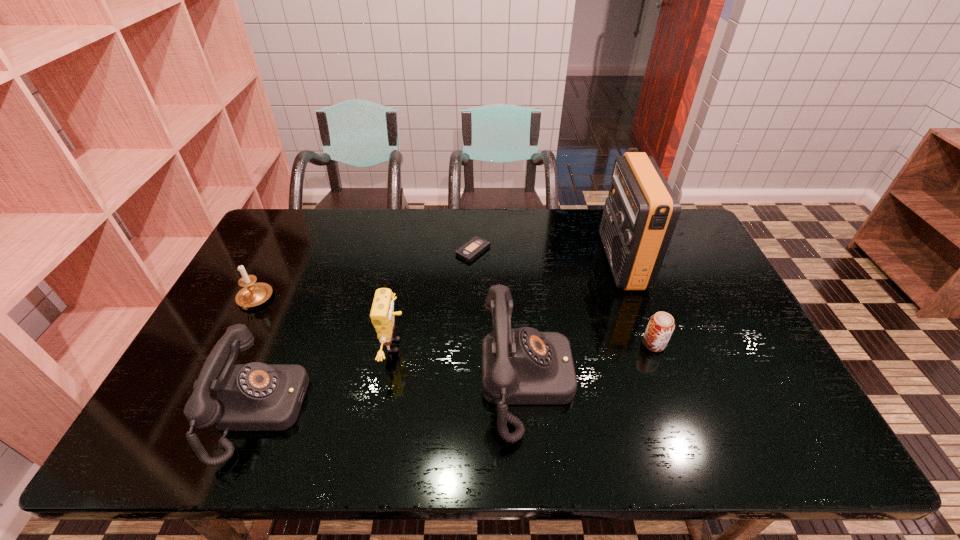
Where is `the left telephone`? This screenshot has width=960, height=540. the left telephone is located at coordinates (255, 396).

At what (x,y) coordinates should I click in order to perform the action: click on the shorter telephone. Please return your answer as a coordinate pair (x, y). Looking at the image, I should click on 255,396.

Find the location of a particular element. This screenshot has height=540, width=960. the taller telephone is located at coordinates (519, 366).

Where is `the shortest object`? the shortest object is located at coordinates (473, 248).

You are a GUI agent. You are given a task and a screenshot of the screen. Output one action in this format:
    pyautogui.click(x=<x>, y=<y>)
    Task: Click on the tallest object
    Image resolution: width=960 pixels, height=540 pixels.
    Given the screenshot: What is the action you would take?
    pyautogui.click(x=641, y=211)

Identify the location of candle holder. (253, 294).

This screenshot has width=960, height=540. What are the coordinates of `the leftmost object` in the screenshot? It's located at (253, 294).

At what (x,y) coordinates should I click in order to perform the action: click on sponge. Please return your answer as a coordinate pair (x, y). Image resolution: width=960 pixels, height=540 pixels. Looking at the image, I should click on (382, 314).

Where is `beer can`? beer can is located at coordinates (661, 325).

Where is `free location located on the dial of the left telephone`? The image size is (960, 540). free location located on the dial of the left telephone is located at coordinates (360, 409).